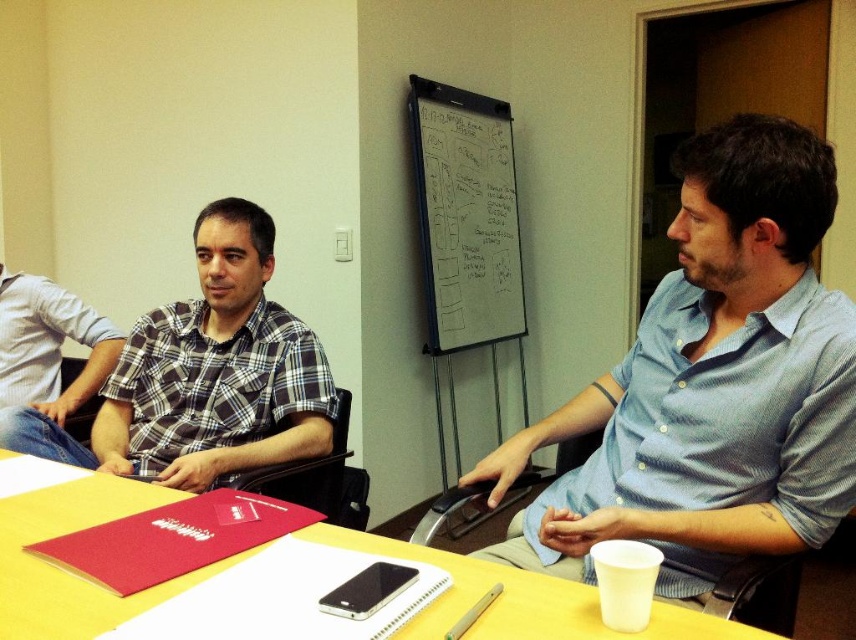
Is blue striped shirt at center further to camera compared to plaid cotton shirt at center?

No.

Which is behind, point (521, 566) or point (186, 476)?

The point (186, 476) is more distant.

You are a GUI agent. You are given a task and a screenshot of the screen. Output one action in this format:
    pyautogui.click(x=<x>, y=<y>)
    Task: Click on the blue striped shirt at center
    Image resolution: width=856 pixels, height=640 pixels.
    Given the screenshot: What is the action you would take?
    pyautogui.click(x=711, y=384)

Does blue striped shirt at center have a smaller size compared to whiteboard at upper center?

Indeed, blue striped shirt at center has a smaller size compared to whiteboard at upper center.

Is point (782, 369) in front of point (504, 211)?

Yes.

Locate an element on the screen. This screenshot has width=856, height=640. blue striped shirt at center is located at coordinates (711, 384).

In the scene shown: Can you confirm if whiteboard at upper center is positioned to the left of black leather chair at left?

In fact, whiteboard at upper center is to the right of black leather chair at left.

From the picture: Is whiteboard at upper center wider than black leather chair at left?

Yes, whiteboard at upper center is wider than black leather chair at left.

Locate an element on the screen. whiteboard at upper center is located at coordinates (465, 216).